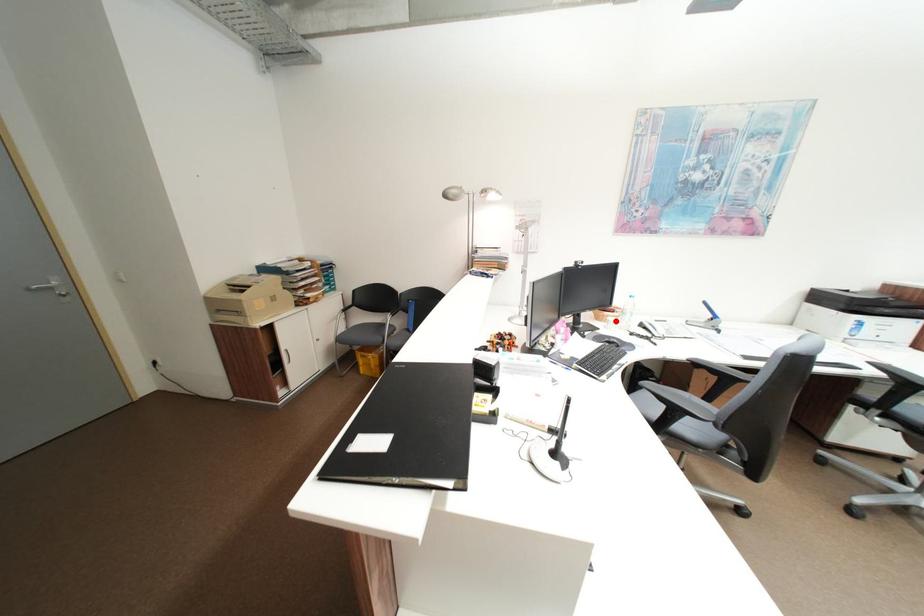
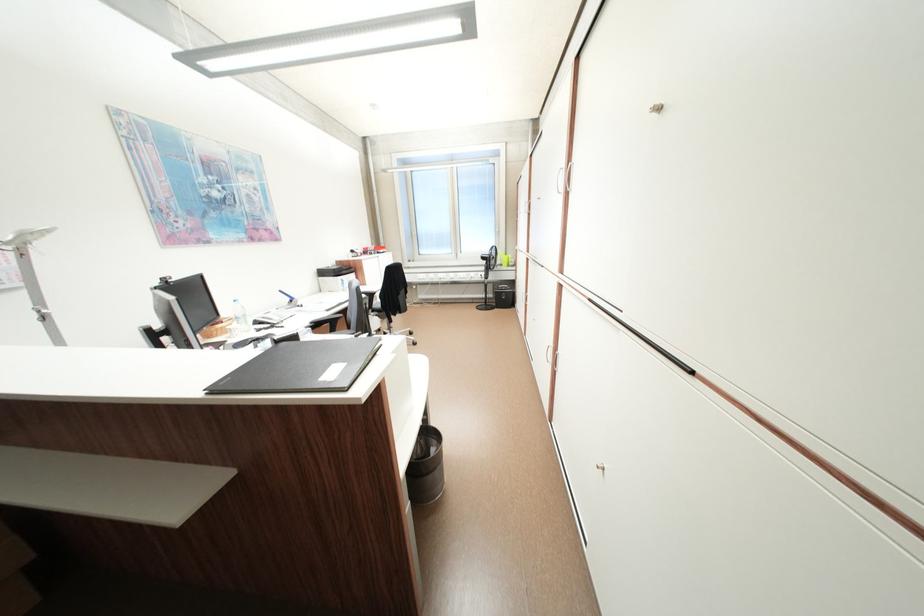
The point at the highlighted location is marked in the first image. Where is the corresponding point in the second image?

(235, 331)